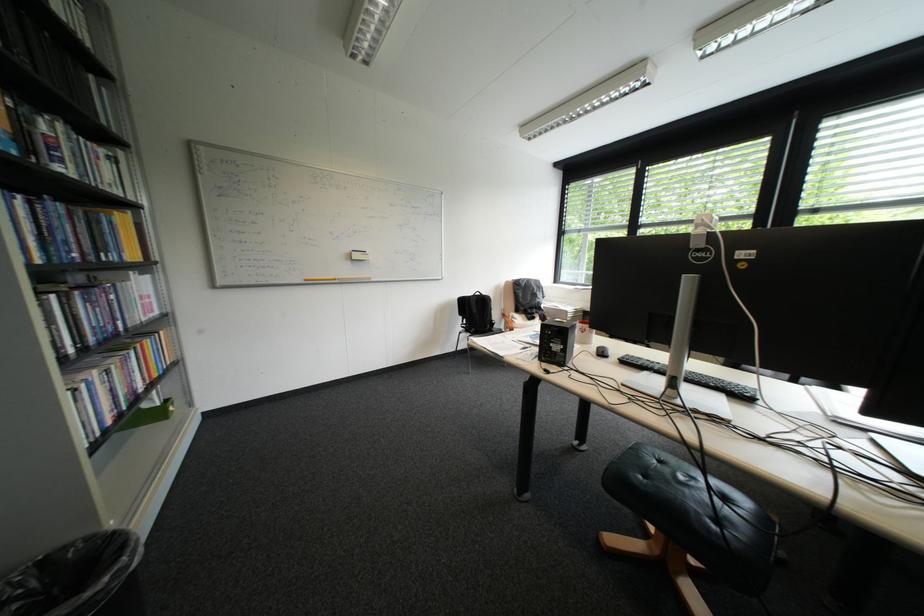
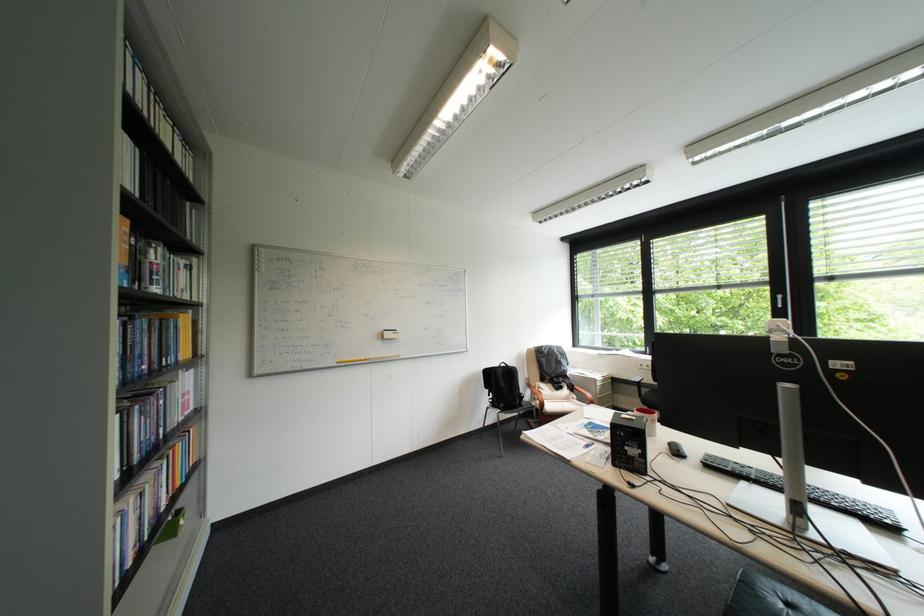
In the second image, find the point that corresponds to (x=659, y=373) in the first image.

(757, 484)